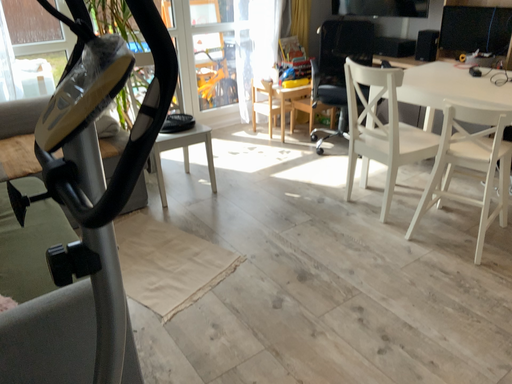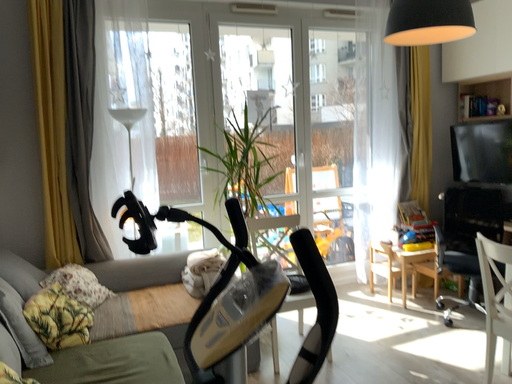
Question: How did the camera likely rotate when shooting the video?

Choices:
 (A) rotated downward
 (B) rotated upward

Answer: (B)